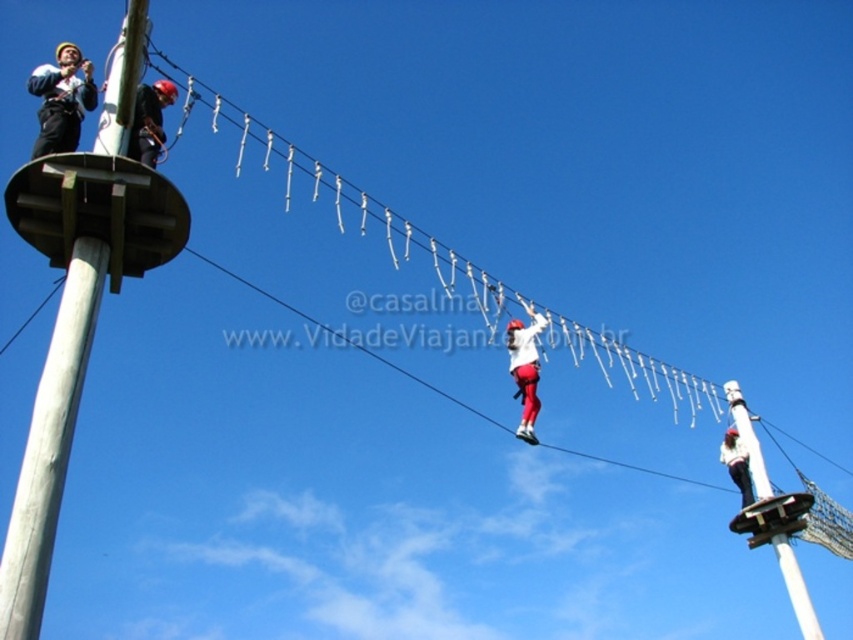
Is white matte helmet at center below matte black helmet at upper center?

Indeed, white matte helmet at center is positioned under matte black helmet at upper center.

What are the coordinates of `white matte helmet at center` in the screenshot? It's located at (525, 369).

Locate an element on the screen. white matte helmet at center is located at coordinates (525, 369).

Does point (106, 93) lie in front of point (733, 442)?

Yes, it is in front of point (733, 442).

Is white wood pole at upper left wider than white matte helmet at upper center?

Yes.

Is point (38, 604) farther from viewer compared to point (718, 460)?

No.

Find the location of `white wood pole at upper left`. white wood pole at upper left is located at coordinates (49, 445).

Between white painted wood pole at right and matte black helmet at upper center, which one appears on the left side from the viewer's perspective?

From the viewer's perspective, matte black helmet at upper center appears more on the left side.

Does point (751, 460) come farther from viewer compared to point (132, 138)?

That is True.

The image size is (853, 640). I want to click on white painted wood pole at right, so click(772, 516).